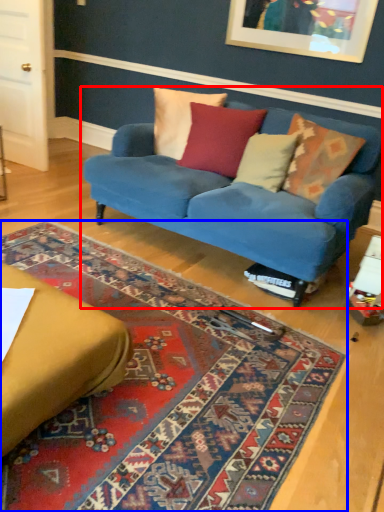
Question: Which object appears closest to the camera in this image, studio couch (highlighted by a red box) or mat (highlighted by a blue box)?

Choices:
 (A) studio couch
 (B) mat

Answer: (B)